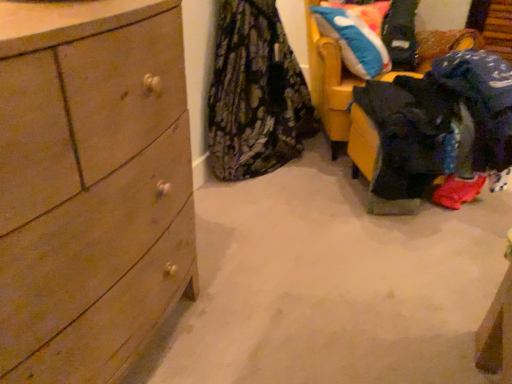
Question: Is dark blue fabric at lower right, the first clothing in the right-to-left sequence, a part of wooden dresser at left?

Choices:
 (A) no
 (B) yes

Answer: (A)

Question: Is wooden dresser at left turned away from dark blue fabric at lower right, which is the second clothing from left to right?

Choices:
 (A) no
 (B) yes

Answer: (A)

Question: Is wooden dresser at left oriented towards dark blue fabric at lower right, which is the second clothing from left to right?

Choices:
 (A) yes
 (B) no

Answer: (B)

Question: From the image's perspective, is wooden dresser at left on top of dark blue fabric at lower right, which is the second clothing from left to right?

Choices:
 (A) yes
 (B) no

Answer: (B)

Question: Is wooden dresser at left completely or partially outside of dark blue fabric at lower right, the first clothing in the right-to-left sequence?

Choices:
 (A) yes
 (B) no

Answer: (A)

Question: Does wooden dresser at left appear on the left side of dark blue fabric at lower right, the first clothing in the right-to-left sequence?

Choices:
 (A) no
 (B) yes

Answer: (B)

Question: From a real-world perspective, is dark blue fabric at lower right, the first clothing in the right-to-left sequence, physically above blue plush pillow at upper right?

Choices:
 (A) no
 (B) yes

Answer: (A)

Question: Is blue plush pillow at upper right located within dark blue fabric at lower right, the first clothing in the right-to-left sequence?

Choices:
 (A) yes
 (B) no

Answer: (B)

Question: Is dark blue fabric at lower right, which is the second clothing from left to right, further to camera compared to blue plush pillow at upper right?

Choices:
 (A) no
 (B) yes

Answer: (A)

Question: From the image's perspective, does dark blue fabric at lower right, the first clothing in the right-to-left sequence, appear higher than blue plush pillow at upper right?

Choices:
 (A) yes
 (B) no

Answer: (B)

Question: From a real-world perspective, is dark blue fabric at lower right, which is the second clothing from left to right, physically below blue plush pillow at upper right?

Choices:
 (A) no
 (B) yes

Answer: (B)

Question: Considering the relative sizes of dark blue fabric at lower right, which is the second clothing from left to right, and blue plush pillow at upper right in the image provided, is dark blue fabric at lower right, which is the second clothing from left to right, shorter than blue plush pillow at upper right?

Choices:
 (A) yes
 (B) no

Answer: (B)

Question: Considering the relative sizes of blue plush pillow at upper right and yellow fabric chair at upper right in the image provided, is blue plush pillow at upper right thinner than yellow fabric chair at upper right?

Choices:
 (A) no
 (B) yes

Answer: (B)